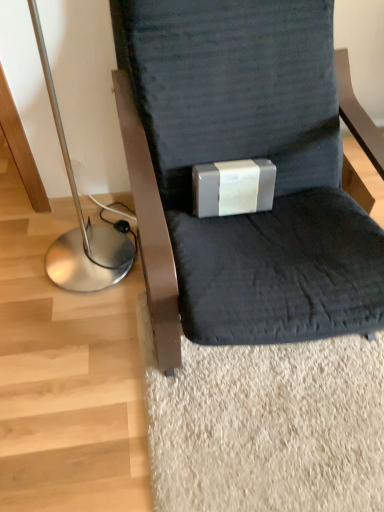
Question: Is silver metallic floor lamp at left positioned with its back to matte gray box at center?

Choices:
 (A) no
 (B) yes

Answer: (A)

Question: Does silver metallic floor lamp at left have a greater height compared to matte gray box at center?

Choices:
 (A) no
 (B) yes

Answer: (B)

Question: Is silver metallic floor lamp at left in front of matte gray box at center?

Choices:
 (A) yes
 (B) no

Answer: (A)

Question: Is silver metallic floor lamp at left facing towards matte gray box at center?

Choices:
 (A) yes
 (B) no

Answer: (B)

Question: From the image's perspective, would you say silver metallic floor lamp at left is positioned over matte gray box at center?

Choices:
 (A) yes
 (B) no

Answer: (A)

Question: From the image's perspective, is silver metallic floor lamp at left under matte gray box at center?

Choices:
 (A) yes
 (B) no

Answer: (B)

Question: Can you confirm if matte gray cushion at center is shorter than silver metallic floor lamp at left?

Choices:
 (A) yes
 (B) no

Answer: (B)

Question: From the image's perspective, is matte gray cushion at center located beneath silver metallic floor lamp at left?

Choices:
 (A) yes
 (B) no

Answer: (A)

Question: Is matte gray cushion at center bigger than silver metallic floor lamp at left?

Choices:
 (A) yes
 (B) no

Answer: (A)

Question: Considering the relative positions of matte gray cushion at center and silver metallic floor lamp at left in the image provided, is matte gray cushion at center to the left of silver metallic floor lamp at left from the viewer's perspective?

Choices:
 (A) no
 (B) yes

Answer: (A)

Question: Considering the relative sizes of matte gray cushion at center and silver metallic floor lamp at left in the image provided, is matte gray cushion at center smaller than silver metallic floor lamp at left?

Choices:
 (A) no
 (B) yes

Answer: (A)

Question: Is matte gray cushion at center far away from silver metallic floor lamp at left?

Choices:
 (A) no
 (B) yes

Answer: (A)

Question: Can you confirm if matte gray box at center is positioned to the right of silver metallic floor lamp at left?

Choices:
 (A) no
 (B) yes

Answer: (B)